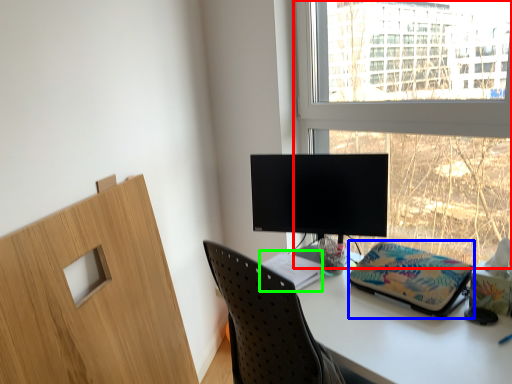
Question: Estimate the real-world distances between objects in this image. Which object is farther from window (highlighted by a red box), stationery (highlighted by a blue box) or notebook (highlighted by a green box)?

Choices:
 (A) stationery
 (B) notebook

Answer: (B)